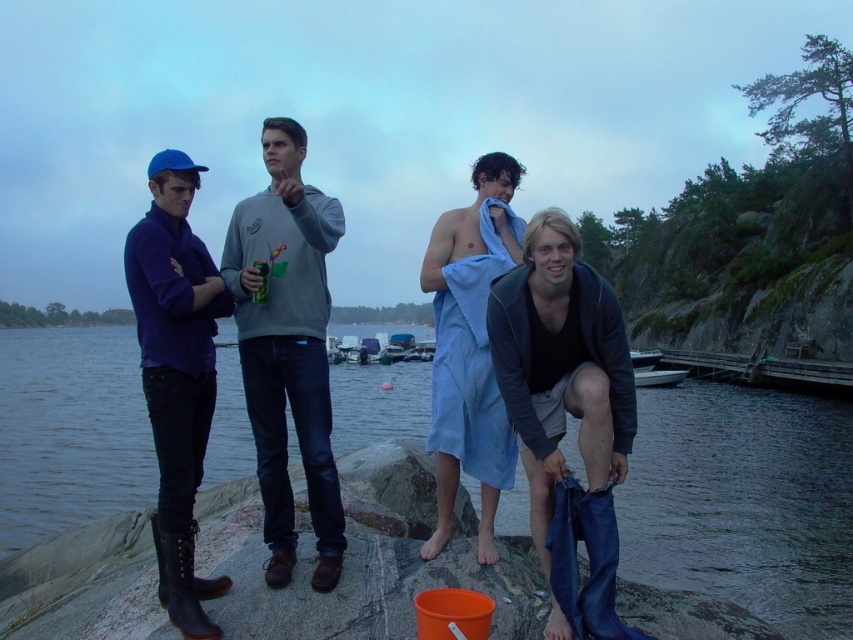
Question: Can you confirm if matte gray hoodie at center is thinner than dark blue denim shorts at lower right?

Choices:
 (A) yes
 (B) no

Answer: (B)

Question: Does blue towel at center appear over blue towel at lower right?

Choices:
 (A) yes
 (B) no

Answer: (A)

Question: Which point is farther from the camera taking this photo?

Choices:
 (A) [225, 298]
 (B) [585, 301]

Answer: (A)

Question: Which object appears closest to the camera in this image?

Choices:
 (A) blue towel at center
 (B) blue towel at lower right
 (C) matte blue sweater at left
 (D) transparent water at lower left

Answer: (C)

Question: Does transparent water at lower left appear under matte gray hoodie at center?

Choices:
 (A) no
 (B) yes

Answer: (B)

Question: Which object is farther from the camera taking this photo?

Choices:
 (A) matte blue sweater at left
 (B) blue towel at lower right
 (C) blue towel at center
 (D) transparent water at lower left

Answer: (D)